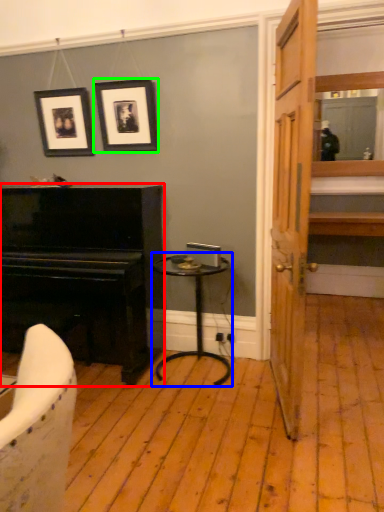
Question: Which object is the closest to the piano (highlighted by a red box)? Choose among these: table (highlighted by a blue box) or picture frame (highlighted by a green box).

Choices:
 (A) table
 (B) picture frame

Answer: (A)